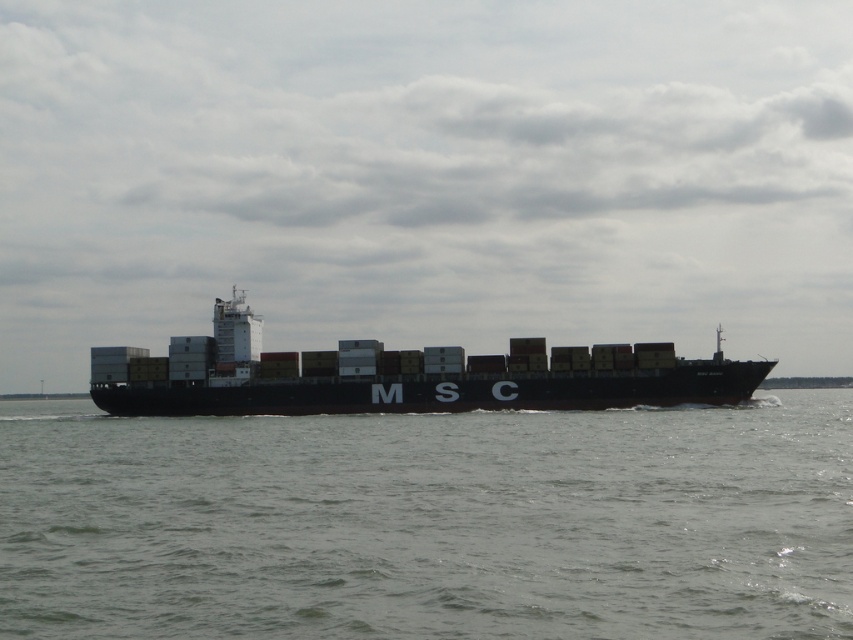
Does gray matte water at center appear over black matte container ship at center?

No.

Locate an element on the screen. This screenshot has height=640, width=853. gray matte water at center is located at coordinates (428, 522).

I want to click on gray matte water at center, so click(x=428, y=522).